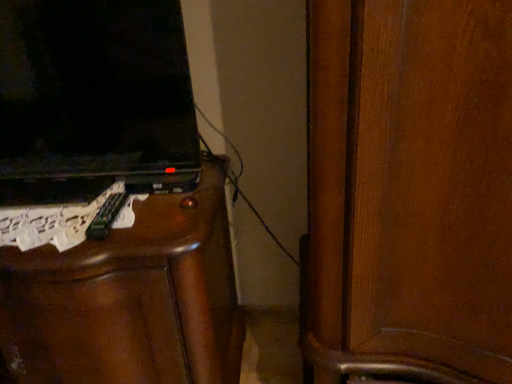
Measure the distance between brown wood tv stand at left and camera.

brown wood tv stand at left and camera are 30.63 inches apart from each other.

Identify the location of brown wood tv stand at left. (130, 299).

Image resolution: width=512 pixels, height=384 pixels. What do you see at coordinates (130, 299) in the screenshot? I see `brown wood tv stand at left` at bounding box center [130, 299].

You are a GUI agent. You are given a task and a screenshot of the screen. Output one action in this format:
    pyautogui.click(x=<x>, y=<y>)
    Task: Click on the brown wood tv stand at left
    This screenshot has width=512, height=384.
    Given the screenshot: What is the action you would take?
    pyautogui.click(x=130, y=299)